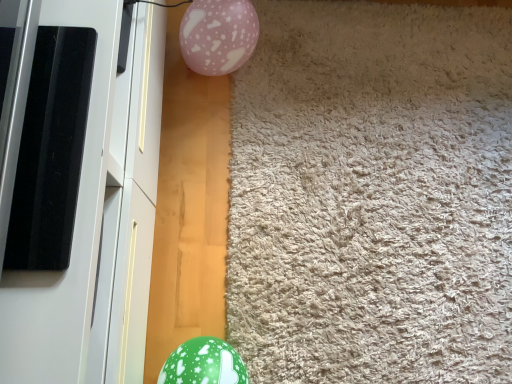
Question: Is beige shaggy carpet at center in contact with pink glossy balloon at upper center?

Choices:
 (A) yes
 (B) no

Answer: (B)

Question: Could pink glossy balloon at upper center be considered to be inside beige shaggy carpet at center?

Choices:
 (A) no
 (B) yes

Answer: (A)

Question: From the image's perspective, is beige shaggy carpet at center beneath pink glossy balloon at upper center?

Choices:
 (A) yes
 (B) no

Answer: (A)

Question: Is beige shaggy carpet at center further to the viewer compared to pink glossy balloon at upper center?

Choices:
 (A) no
 (B) yes

Answer: (A)

Question: From a real-world perspective, is beige shaggy carpet at center physically below pink glossy balloon at upper center?

Choices:
 (A) yes
 (B) no

Answer: (A)

Question: Is point (184, 29) positioned closer to the camera than point (51, 273)?

Choices:
 (A) farther
 (B) closer

Answer: (A)

Question: In the image, is pink glossy balloon at upper center on the left side or the right side of white glossy screen door at left?

Choices:
 (A) right
 (B) left

Answer: (A)

Question: Based on their sizes in the image, would you say pink glossy balloon at upper center is bigger or smaller than white glossy screen door at left?

Choices:
 (A) small
 (B) big

Answer: (A)

Question: Is pink glossy balloon at upper center inside the boundaries of white glossy screen door at left, or outside?

Choices:
 (A) inside
 (B) outside

Answer: (B)

Question: From a real-world perspective, is green glossy balloon at lower left above or below beige shaggy carpet at center?

Choices:
 (A) below
 (B) above

Answer: (B)

Question: Relative to beige shaggy carpet at center, is green glossy balloon at lower left in front or behind?

Choices:
 (A) front
 (B) behind

Answer: (A)

Question: Do you think green glossy balloon at lower left is within beige shaggy carpet at center, or outside of it?

Choices:
 (A) outside
 (B) inside

Answer: (A)

Question: Considering the positions of green glossy balloon at lower left and beige shaggy carpet at center in the image, is green glossy balloon at lower left bigger or smaller than beige shaggy carpet at center?

Choices:
 (A) small
 (B) big

Answer: (A)

Question: From their relative heights in the image, would you say beige shaggy carpet at center is taller or shorter than pink glossy balloon at upper center?

Choices:
 (A) tall
 (B) short

Answer: (B)

Question: Is beige shaggy carpet at center in front of or behind pink glossy balloon at upper center in the image?

Choices:
 (A) behind
 (B) front

Answer: (B)